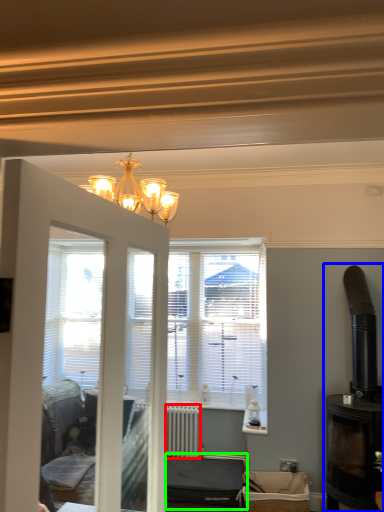
Question: Based on their relative distances, which object is nearer to radiator (highlighted by a red box)? Choose from fireplace (highlighted by a blue box) and furniture (highlighted by a green box).

Choices:
 (A) fireplace
 (B) furniture

Answer: (B)